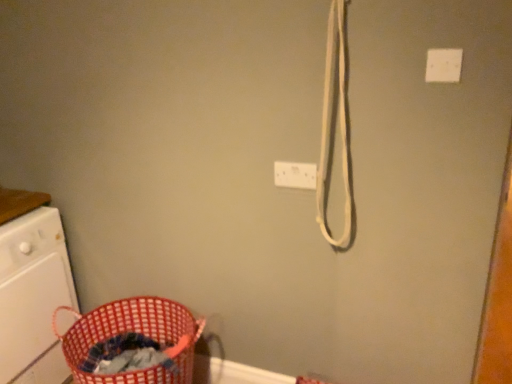
Question: Is white plastic electric outlet at upper center oriented away from red woven laundry basket at lower left?

Choices:
 (A) no
 (B) yes

Answer: (A)

Question: Is there a large distance between white plastic electric outlet at upper center and red woven laundry basket at lower left?

Choices:
 (A) no
 (B) yes

Answer: (A)

Question: From a real-world perspective, is white plastic electric outlet at upper center over red woven laundry basket at lower left?

Choices:
 (A) no
 (B) yes

Answer: (B)

Question: Considering the relative sizes of white plastic electric outlet at upper center and red woven laundry basket at lower left in the image provided, is white plastic electric outlet at upper center taller than red woven laundry basket at lower left?

Choices:
 (A) no
 (B) yes

Answer: (A)

Question: Could you tell me if white plastic electric outlet at upper center is turned towards red woven laundry basket at lower left?

Choices:
 (A) yes
 (B) no

Answer: (B)

Question: Does white plastic electric outlet at upper center appear on the left side of red woven laundry basket at lower left?

Choices:
 (A) no
 (B) yes

Answer: (A)

Question: Is white plastic light switch at upper right shorter than white plastic electric outlet at upper center?

Choices:
 (A) no
 (B) yes

Answer: (B)

Question: Considering the relative positions of white plastic light switch at upper right and white plastic electric outlet at upper center in the image provided, is white plastic light switch at upper right to the left of white plastic electric outlet at upper center from the viewer's perspective?

Choices:
 (A) no
 (B) yes

Answer: (A)

Question: Does white plastic light switch at upper right lie behind white plastic electric outlet at upper center?

Choices:
 (A) yes
 (B) no

Answer: (B)

Question: Considering the relative positions of white plastic light switch at upper right and white plastic electric outlet at upper center in the image provided, is white plastic light switch at upper right in front of white plastic electric outlet at upper center?

Choices:
 (A) no
 (B) yes

Answer: (B)

Question: Is white plastic light switch at upper right looking in the opposite direction of white plastic electric outlet at upper center?

Choices:
 (A) yes
 (B) no

Answer: (B)

Question: From a real-world perspective, is white plastic light switch at upper right physically below white plastic electric outlet at upper center?

Choices:
 (A) no
 (B) yes

Answer: (A)

Question: Considering the relative sizes of white plastic washing machine at left and red woven laundry basket at lower left in the image provided, is white plastic washing machine at left smaller than red woven laundry basket at lower left?

Choices:
 (A) no
 (B) yes

Answer: (A)